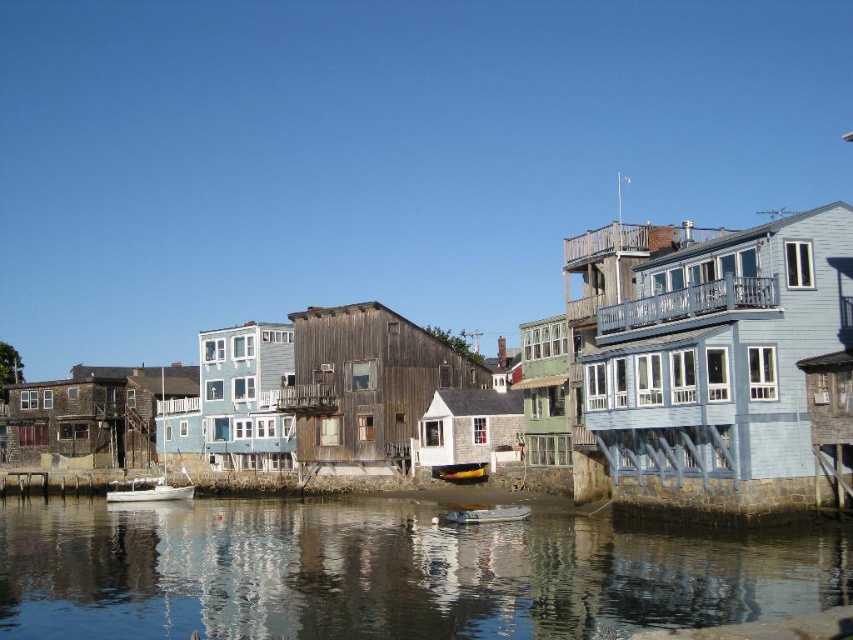
Question: Which object is farther from the camera taking this photo?

Choices:
 (A) clear water at lower center
 (B) white matte boat at lower left

Answer: (B)

Question: Can you confirm if white matte boat at lower left is bigger than white glossy boat at center?

Choices:
 (A) no
 (B) yes

Answer: (B)

Question: Is clear water at lower center above yellow plastic boat at center?

Choices:
 (A) no
 (B) yes

Answer: (A)

Question: Does clear water at lower center lie in front of yellow plastic boat at center?

Choices:
 (A) yes
 (B) no

Answer: (A)

Question: Which object appears closest to the camera in this image?

Choices:
 (A) clear water at lower center
 (B) white matte boat at lower left
 (C) yellow plastic boat at center
 (D) white glossy boat at center

Answer: (A)

Question: Which point appears farthest from the camera in this image?

Choices:
 (A) (483, 632)
 (B) (495, 520)
 (C) (161, 481)
 (D) (454, 467)

Answer: (C)